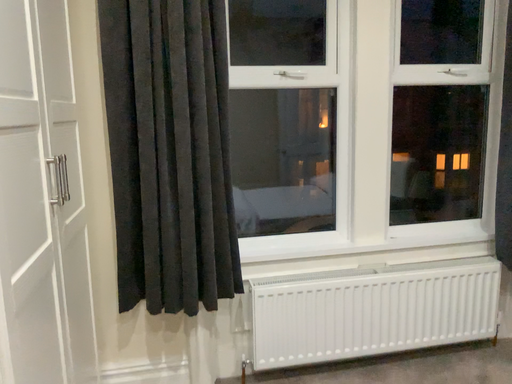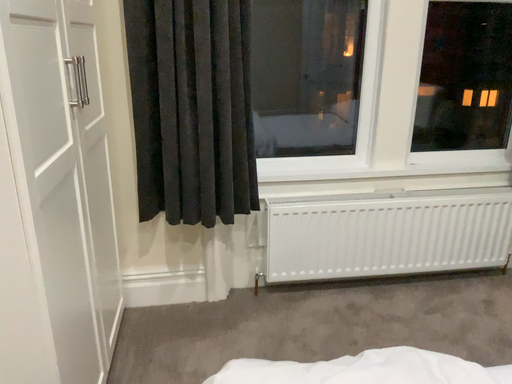
Question: Which way did the camera rotate in the video?

Choices:
 (A) rotated upward
 (B) rotated downward

Answer: (B)